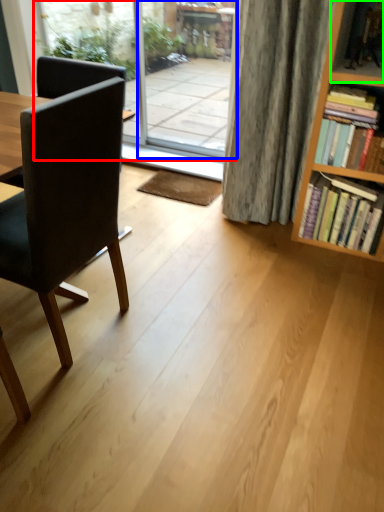
Question: Which is nearer to the window screen (highlighted by a red box)? screen door (highlighted by a blue box) or shelf (highlighted by a green box).

Choices:
 (A) screen door
 (B) shelf

Answer: (A)